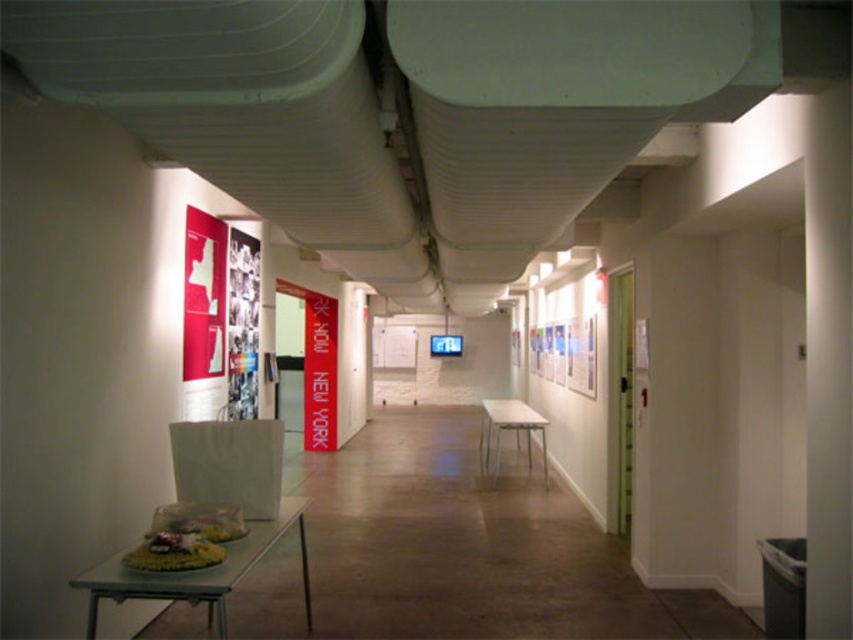
Is white plastic table at lower left positioned behind white glossy table at center?

That is False.

Does white plastic table at lower left have a greater height compared to white glossy table at center?

Yes.

Locate an element on the screen. The width and height of the screenshot is (853, 640). white plastic table at lower left is located at coordinates (200, 572).

This screenshot has width=853, height=640. I want to click on white plastic table at lower left, so click(x=200, y=572).